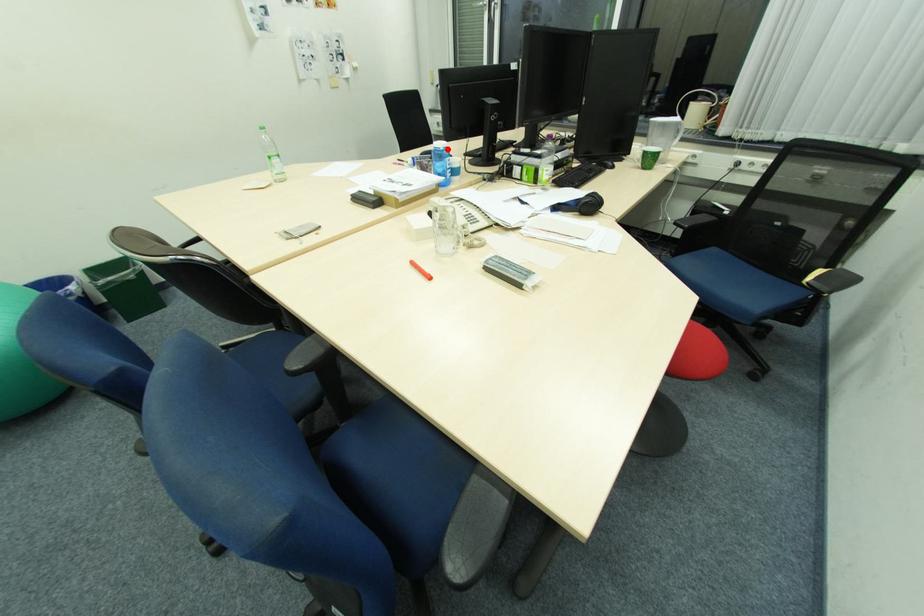
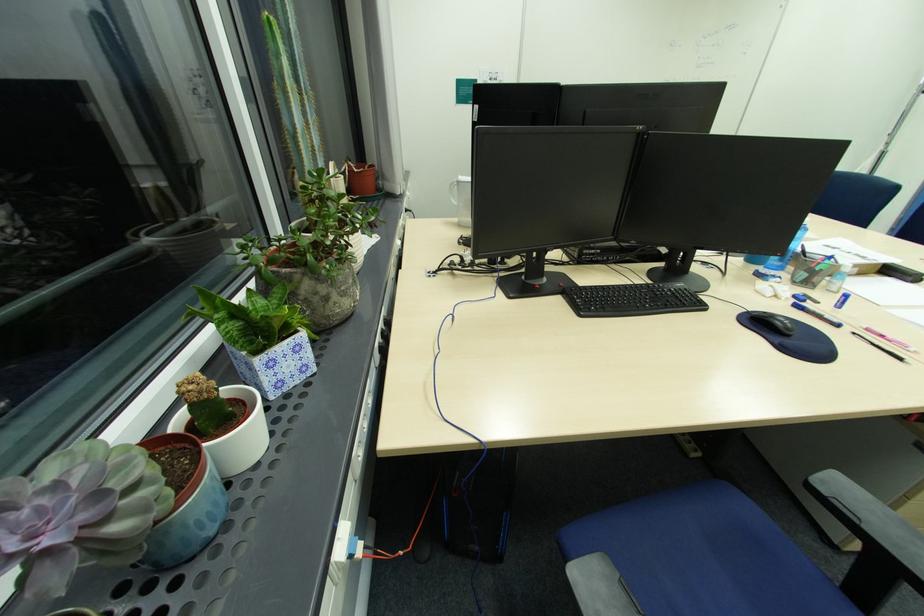
Question: I am providing you with two images of the same scene from different viewpoints. A red point is marked on the first image. At the location where the point appears in image 1, is it still visible in image 2?

Choices:
 (A) Yes
 (B) No

Answer: (B)